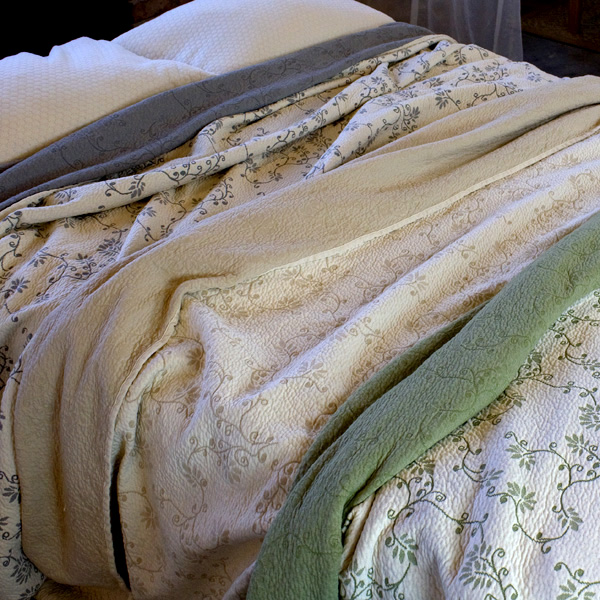
Identify the location of green blanket. (512, 525).